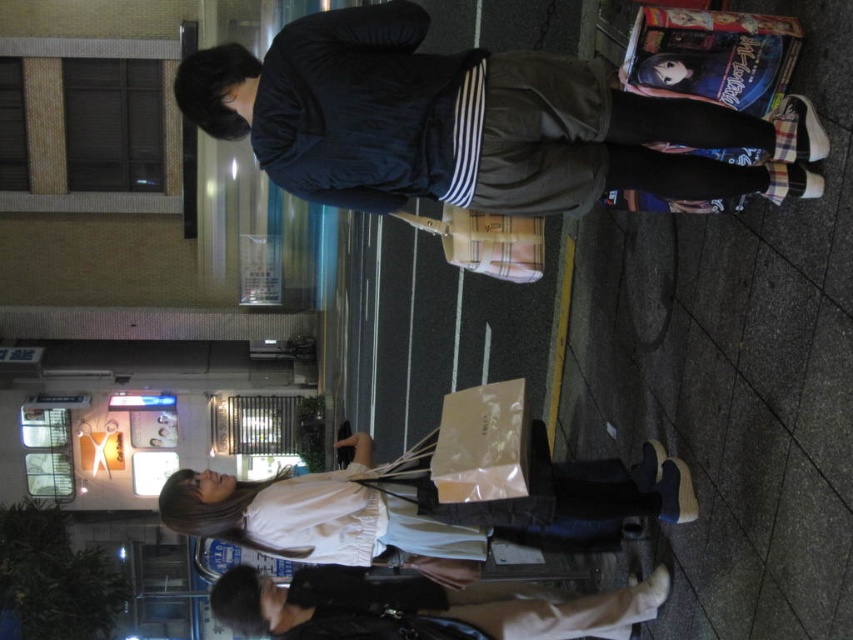
Which is behind, point (645, 508) or point (428, 602)?

Positioned behind is point (428, 602).

Who is more forward, (x=389, y=506) or (x=367, y=604)?

Positioned in front is point (x=389, y=506).

Does point (564, 492) come in front of point (503, 600)?

Yes, it is in front of point (503, 600).

The width and height of the screenshot is (853, 640). I want to click on white cotton blouse at lower center, so click(415, 504).

Is smooth concrete pavement at lower right positioned in front of light beige leather boots at lower center?

Yes, it is.

What are the coordinates of `smooth concrete pavement at lower right` in the screenshot? It's located at (735, 376).

Identify the location of smooth concrete pavement at lower right. [x=735, y=376].

Is light beige leather boots at lower center behind matte beige paper bag at center?

Yes, light beige leather boots at lower center is behind matte beige paper bag at center.

Who is higher up, light beige leather boots at lower center or matte beige paper bag at center?

matte beige paper bag at center

Is point (210, 593) farther from camera compared to point (436, 477)?

Yes, it is.

The image size is (853, 640). Find the location of `light beige leather boots at lower center`. light beige leather boots at lower center is located at coordinates (422, 604).